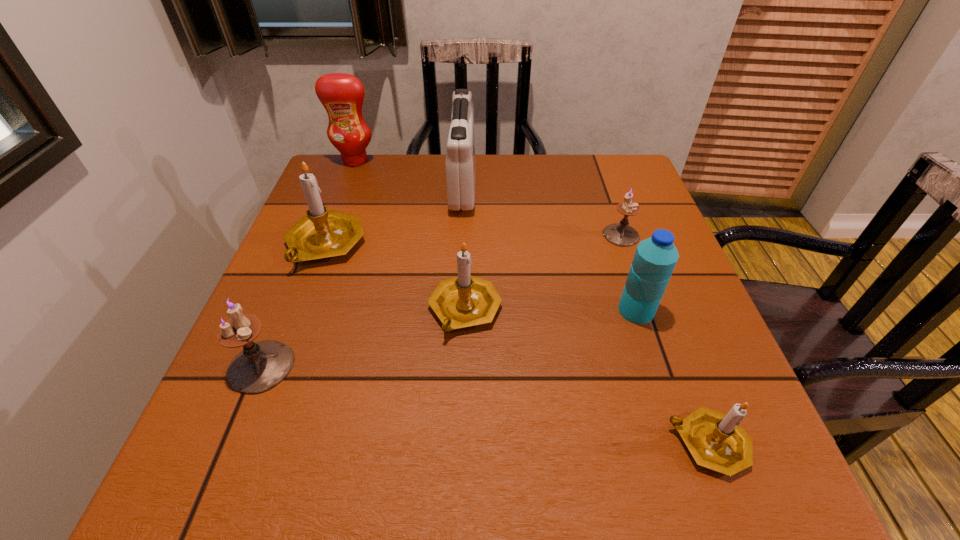
You are a GUI agent. You are given a task and a screenshot of the screen. Output one action in this format:
    pyautogui.click(x=<x>, y=<y>)
    Task: Click on the vacant space at the left edge of the desktop
    This screenshot has height=540, width=960.
    Given the screenshot: What is the action you would take?
    tap(349, 211)

In the image, there is a desktop. Where is `vacant space at the right edge`? This screenshot has height=540, width=960. vacant space at the right edge is located at coordinates (680, 291).

At what (x,y) coordinates should I click in order to perform the action: click on vacant region at the far left corner of the desktop. Please return your answer as a coordinate pair (x, y). The image size is (960, 540). Looking at the image, I should click on (373, 161).

Where is `vacant space at the near left corner`? vacant space at the near left corner is located at coordinates (213, 440).

In order to click on free region at the far right corner in this screenshot , I will do `click(609, 169)`.

Where is `free area in between the rightmost gold candle holder and the blue water bottle`? The width and height of the screenshot is (960, 540). free area in between the rightmost gold candle holder and the blue water bottle is located at coordinates (672, 377).

Identify the location of free space that is in between the smallest gold candle holder and the blue water bottle. (672, 377).

Image resolution: width=960 pixels, height=540 pixels. I want to click on empty space between the second nearest gold candle holder and the red condiment, so click(x=410, y=235).

You are a GUI agent. You are given a task and a screenshot of the screen. Output one action in this format:
    pyautogui.click(x=<x>, y=<y>)
    Task: Click on the free space between the second biggest gold candle holder and the water bottle
    The height and width of the screenshot is (540, 960).
    Given the screenshot: What is the action you would take?
    pyautogui.click(x=550, y=310)

Identify the location of vacant area that lies between the condiment and the nearest gold candle holder. The height and width of the screenshot is (540, 960). (532, 302).